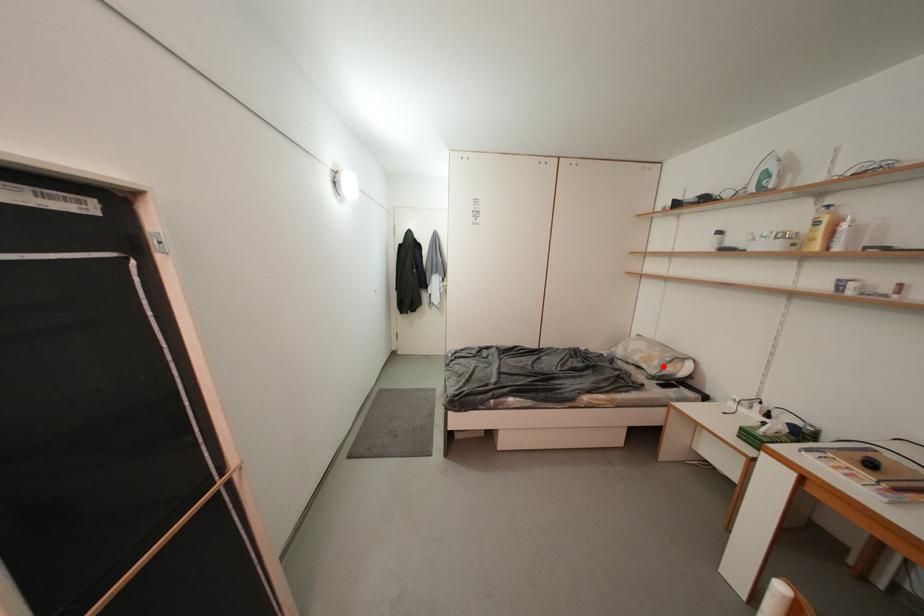
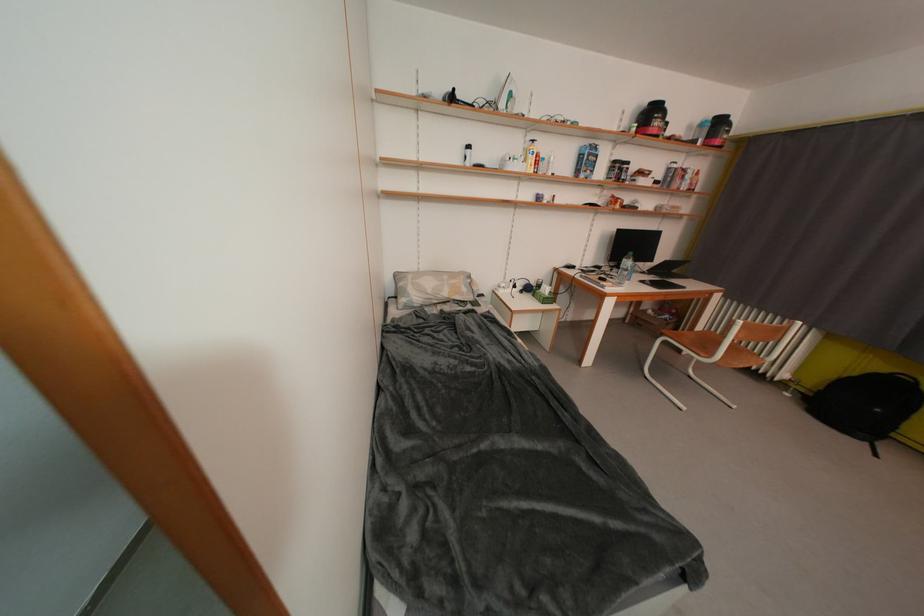
Find the pixel in the second image that matches the highlighted location in the first image.

(471, 293)